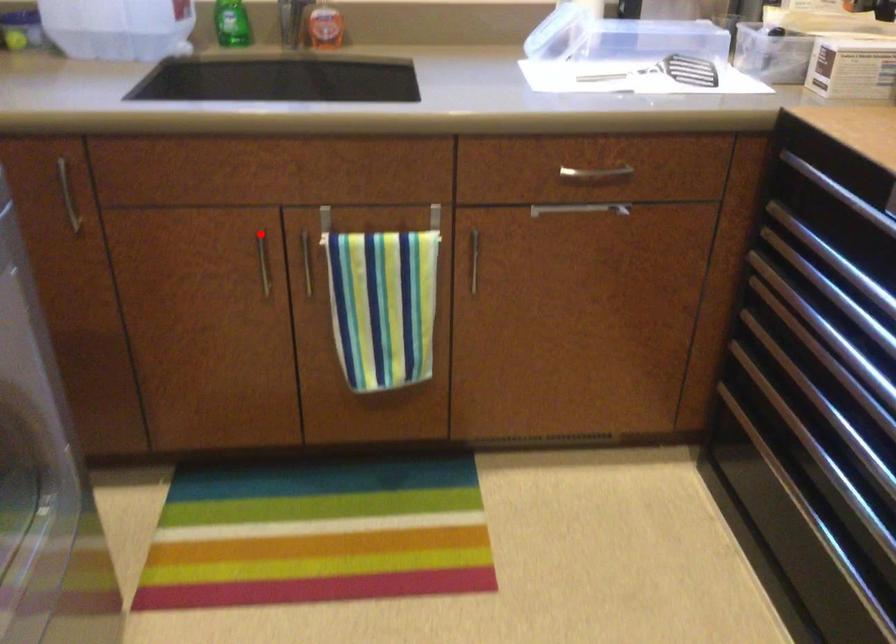
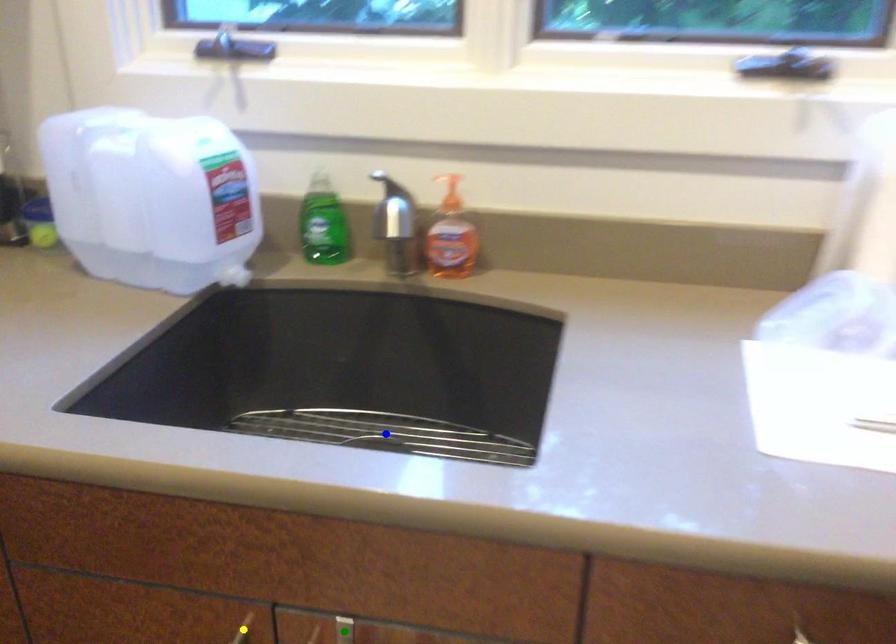
Question: I am providing you with two images of the same scene from different viewpoints. A red point is marked on the first image. You are given multiple points on the second image. Which point in image 2 is actually the same real-world point as the red point in image 1?

Choices:
 (A) green point
 (B) blue point
 (C) yellow point

Answer: (C)